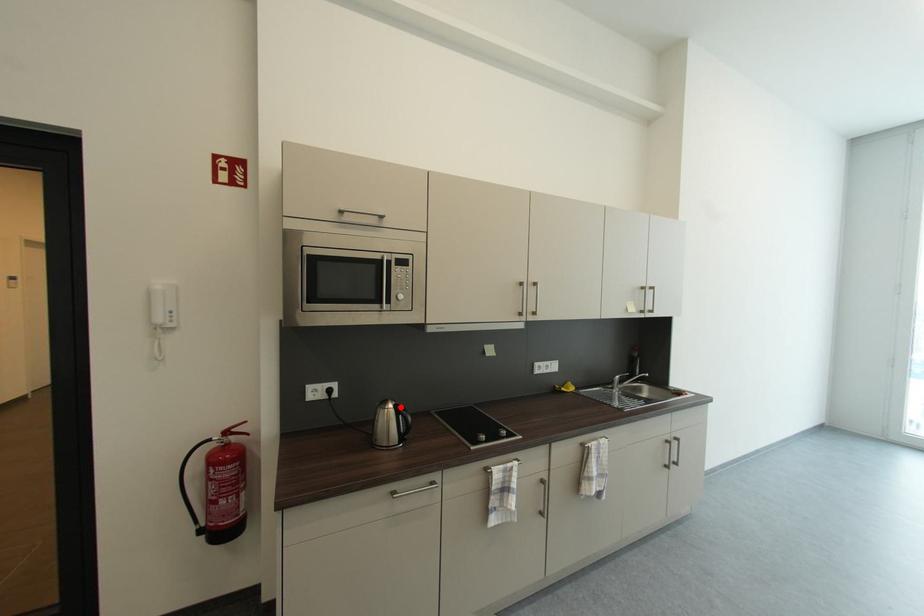
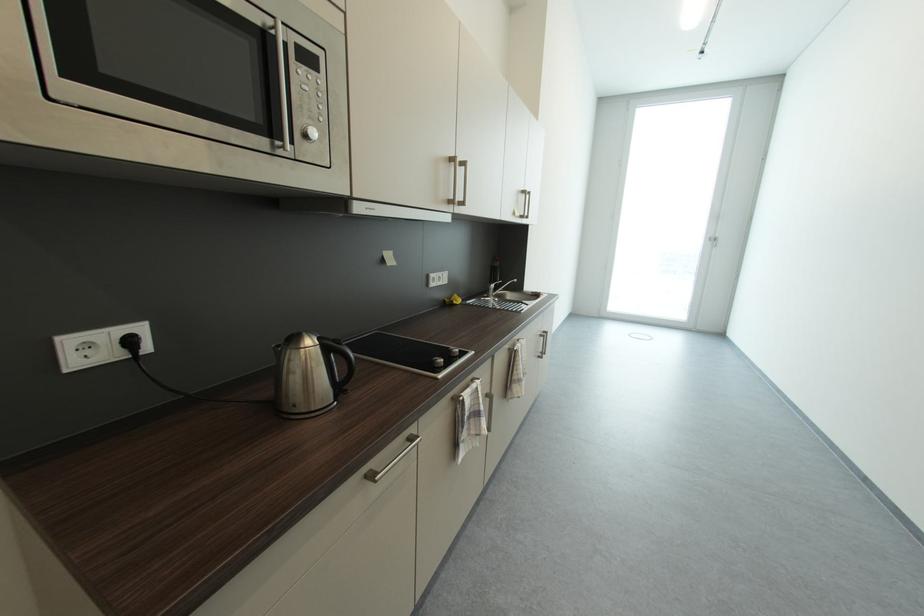
In the second image, find the point that corresponds to the highlighted location in the first image.

(323, 342)